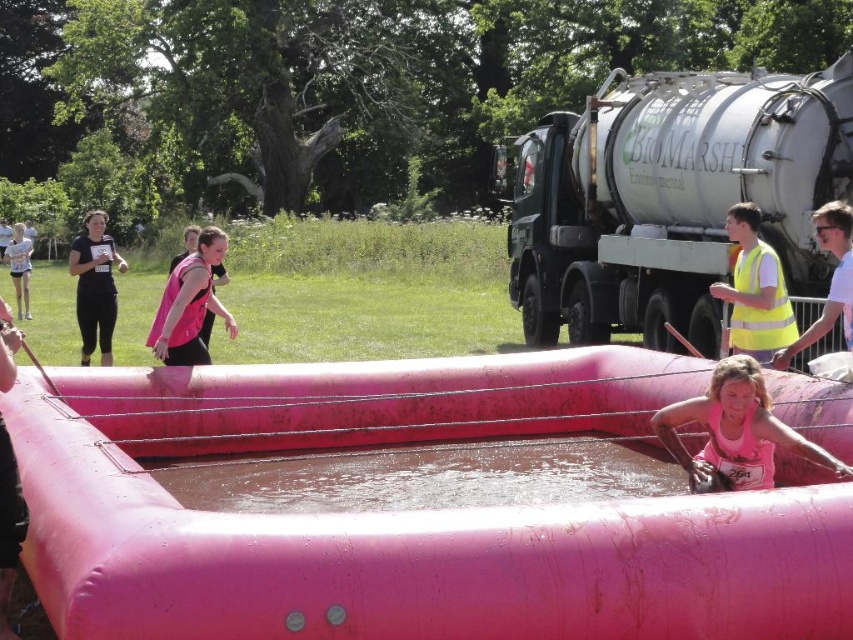
Measure the distance from pink rubber raft at center to clear plastic water at center.

They are 26.59 inches apart.

Can you confirm if pink rubber raft at center is positioned to the left of clear plastic water at center?

Indeed, pink rubber raft at center is positioned on the left side of clear plastic water at center.

Which is in front, point (194, 586) or point (329, 468)?

Point (194, 586)

Locate an element on the screen. The image size is (853, 640). pink rubber raft at center is located at coordinates coord(408,512).

Does yellow reflective vest at right have a smaller size compared to pink matte safety vest at center?

Yes, yellow reflective vest at right is smaller than pink matte safety vest at center.

Between yellow reflective vest at right and pink matte safety vest at center, which one is positioned higher?

pink matte safety vest at center is higher up.

Where is `yellow reflective vest at right`? This screenshot has height=640, width=853. yellow reflective vest at right is located at coordinates (759, 307).

Who is positioned more to the left, matte black tank top at left or pink matte safety vest at center?

matte black tank top at left

Does matte black tank top at left have a lesser width compared to pink matte safety vest at center?

In fact, matte black tank top at left might be wider than pink matte safety vest at center.

Is point (91, 220) behind point (164, 291)?

That is False.

Identify the location of matte black tank top at left. The width and height of the screenshot is (853, 640). (96, 285).